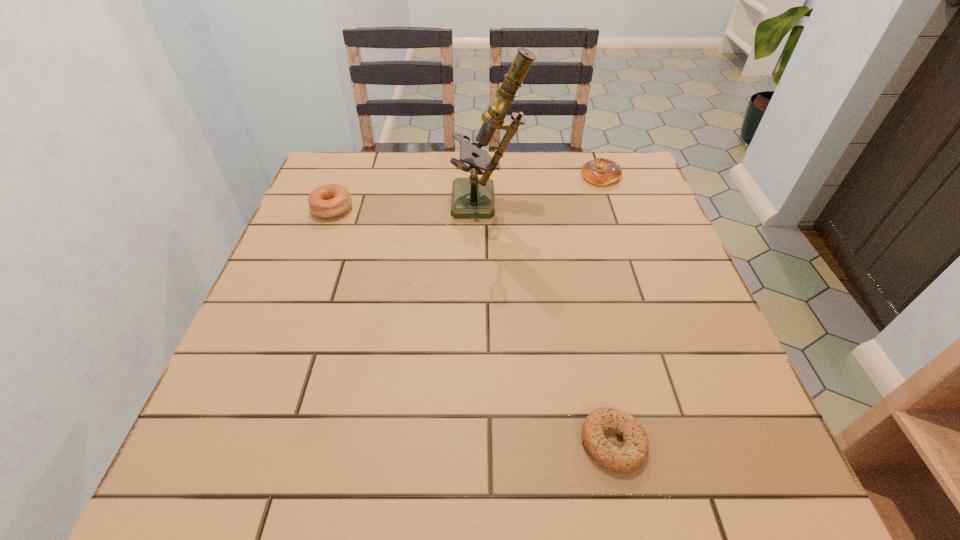
Identify the location of vacant space that satisfies the following two spatial constraints: 1. at the eyepiece of the third object from left to right; 2. on the right side of the tallest object. (493, 442).